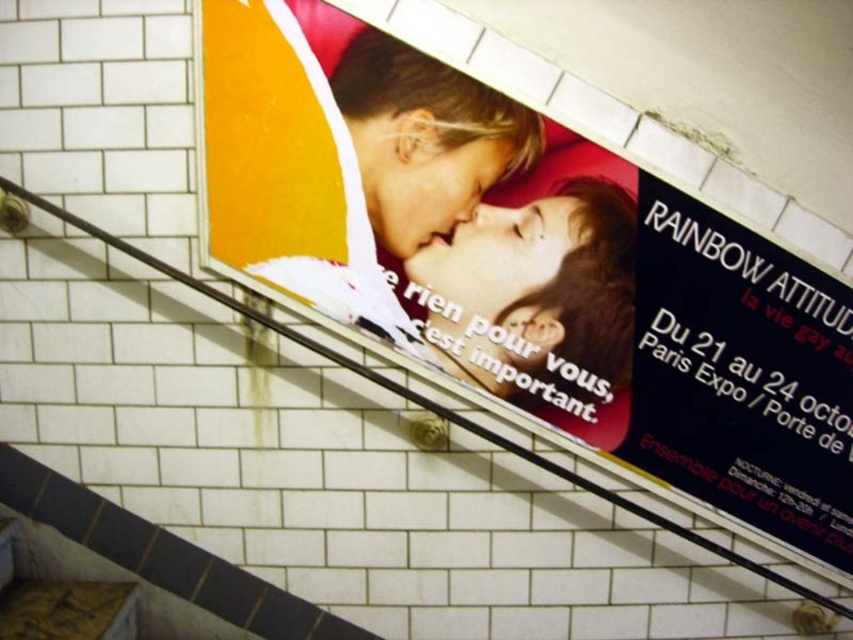
Which of these two, matte plastic poster at center or black glossy poster at upper right, stands shorter?

black glossy poster at upper right is shorter.

Based on the photo, is matte plastic poster at center wider than black glossy poster at upper right?

Correct, the width of matte plastic poster at center exceeds that of black glossy poster at upper right.

Between point (490, 358) and point (845, 563), which one is positioned behind?

The point (845, 563) is more distant.

Find the location of `matte plastic poster at center`. matte plastic poster at center is located at coordinates (540, 285).